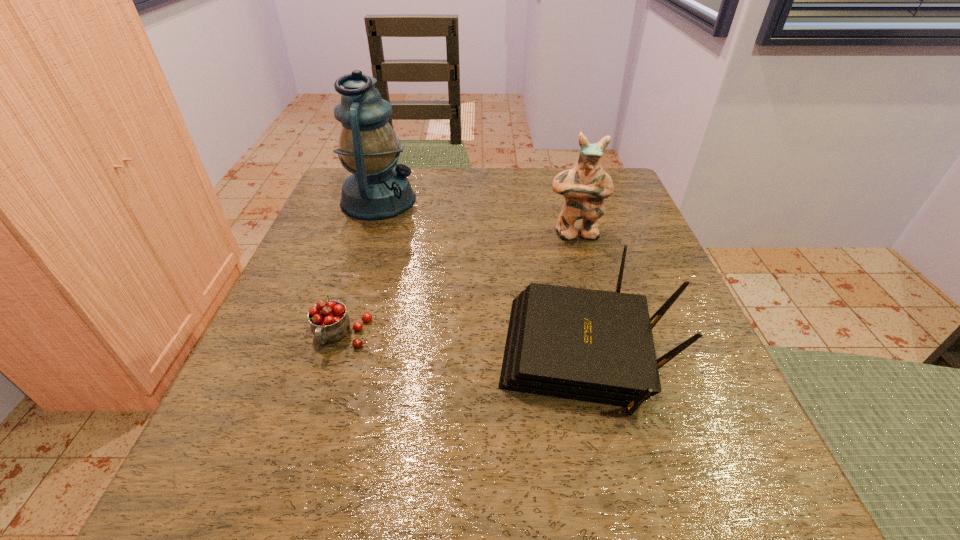
Image resolution: width=960 pixels, height=540 pixels. What are the coordinates of `lantern` in the screenshot? It's located at (368, 147).

At what (x,y) coordinates should I click in order to perform the action: click on figurine. Please return your answer as a coordinate pair (x, y). Looking at the image, I should click on (584, 187).

Image resolution: width=960 pixels, height=540 pixels. What are the coordinates of `router` in the screenshot? It's located at (596, 346).

At what (x,y) coordinates should I click in order to perform the action: click on cherry. Please return your answer as a coordinate pair (x, y). The image size is (960, 540). Looking at the image, I should click on (329, 321).

You are a GUI agent. You are given a task and a screenshot of the screen. Output one action in this format:
    pyautogui.click(x=<x>, y=<y>)
    Task: Click on the vacant space located 0.060m on the face of the tallest object
    This screenshot has width=960, height=540.
    Given the screenshot: What is the action you would take?
    pyautogui.click(x=442, y=200)

The image size is (960, 540). Find the location of `free location located on the front-facing side of the third shortest object`. free location located on the front-facing side of the third shortest object is located at coordinates (588, 282).

Where is `free spot located on the left of the router`? free spot located on the left of the router is located at coordinates (362, 357).

Image resolution: width=960 pixels, height=540 pixels. Find the location of `free region located 0.060m on the handle side of the shortest object`. free region located 0.060m on the handle side of the shortest object is located at coordinates [x=324, y=391].

Find the location of `object situated at the far edge`. object situated at the far edge is located at coordinates (368, 147).

Locate an element on the screen. The image size is (960, 540). lantern situated at the left edge is located at coordinates (368, 147).